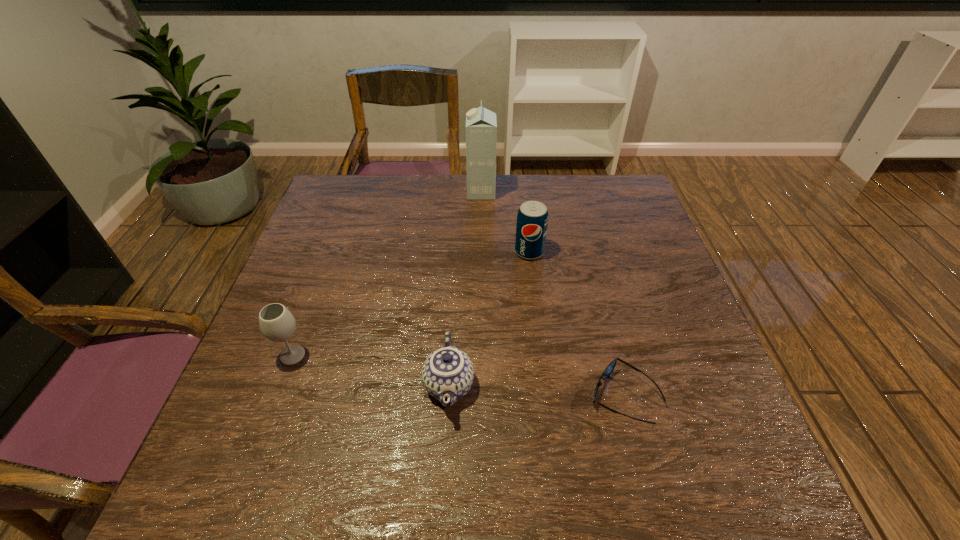
You are a GUI agent. You are given a task and a screenshot of the screen. Output one action in this format:
    pyautogui.click(x=<x>, y=<y>)
    Task: Click on the carton
    The height and width of the screenshot is (540, 960).
    Given the screenshot: What is the action you would take?
    pyautogui.click(x=481, y=124)

The height and width of the screenshot is (540, 960). What are the coordinates of `the tallest object` in the screenshot? It's located at (x=481, y=124).

At what (x,y) coordinates should I click in order to perform the action: click on the fourth object from left to right. Please return your answer as a coordinate pair (x, y). Image resolution: width=960 pixels, height=540 pixels. Looking at the image, I should click on (532, 220).

Locate an element on the screen. This screenshot has height=540, width=960. the fourth nearest object is located at coordinates (532, 220).

Where is `wineglass`? The height and width of the screenshot is (540, 960). wineglass is located at coordinates (277, 324).

Find the location of a particular element. The image size is (960, 540). the fourth tallest object is located at coordinates (447, 374).

Image resolution: width=960 pixels, height=540 pixels. I want to click on sunglasses, so click(611, 366).

This screenshot has width=960, height=540. Find the location of `the rightmost object`. the rightmost object is located at coordinates (611, 366).

This screenshot has height=540, width=960. What are the coordinates of `vacant region located 0.340m on the front label of the farthest object` in the screenshot? It's located at (360, 192).

The width and height of the screenshot is (960, 540). I want to click on vacant position located 0.330m on the front label of the farthest object, so click(363, 192).